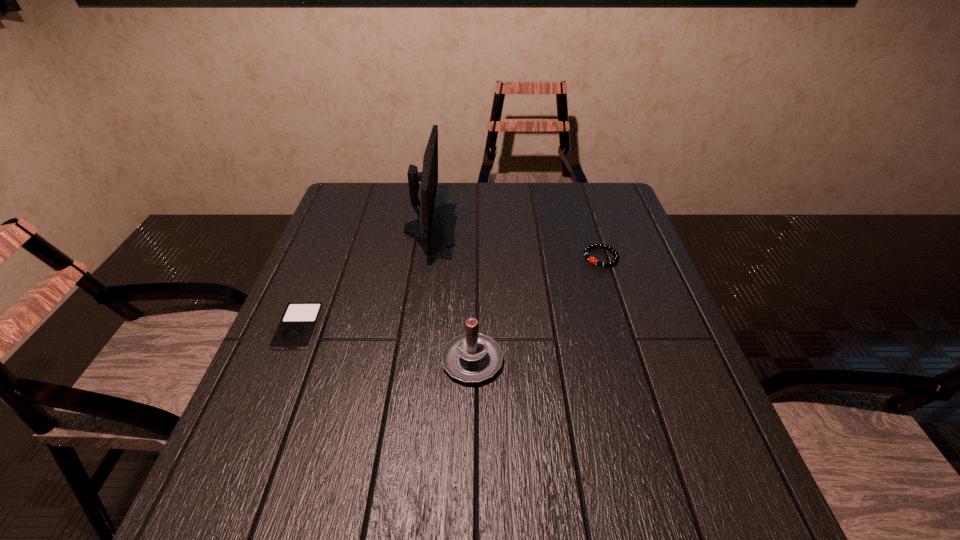
You are a GUI agent. You are given a task and a screenshot of the screen. Output one action in this format:
    pyautogui.click(x=<x>, y=<y>)
    Task: Click on the vacant space located on the back of the rightmost object
    Image resolution: width=960 pixels, height=540 pixels.
    Given the screenshot: What is the action you would take?
    pyautogui.click(x=577, y=182)

Where is `vacant position located 0.150m on the right of the leftmost object`? This screenshot has width=960, height=540. vacant position located 0.150m on the right of the leftmost object is located at coordinates (382, 327).

The image size is (960, 540). What are the coordinates of `object that is at the far edge` in the screenshot? It's located at pos(434,230).

Find the location of a particular element. object present at the left edge is located at coordinates pos(296,329).

Identify the location of object located in the right edge section of the desktop. This screenshot has width=960, height=540. (586, 250).

Find the location of `vacant region at the far edge of the desktop`. vacant region at the far edge of the desktop is located at coordinates (562, 202).

Find the location of a particular element. free point at the near edge is located at coordinates (522, 503).

Image resolution: width=960 pixels, height=540 pixels. In the image, there is a desktop. In order to click on vacant space at the left edge in this screenshot , I will do `click(343, 228)`.

This screenshot has height=540, width=960. I want to click on vacant space at the right edge, so click(647, 308).

What are the coordinates of `free space at the far right corner of the desktop` in the screenshot? It's located at (593, 211).